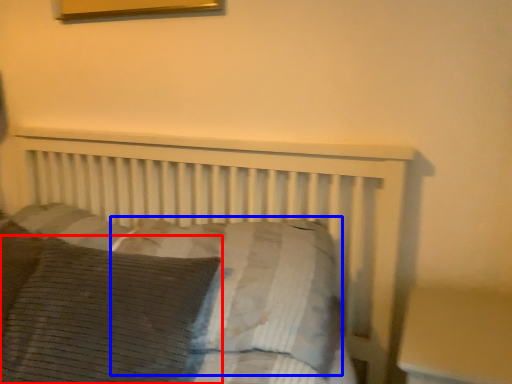
Question: Among these objects, which one is nearest to the camera, pillow (highlighted by a red box) or pillow (highlighted by a blue box)?

Choices:
 (A) pillow
 (B) pillow

Answer: (A)